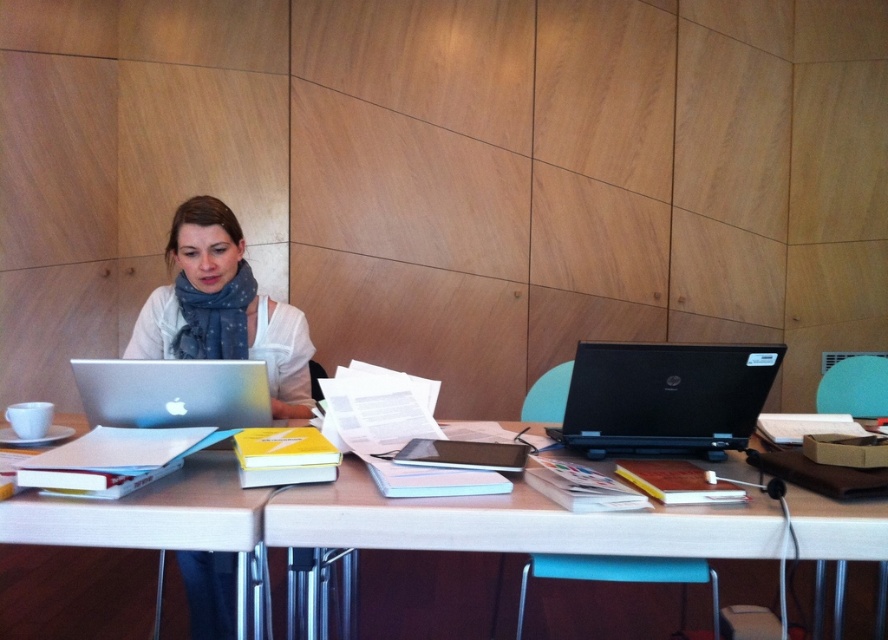
Who is higher up, matte white scarf at upper left or black matte laptop at right?

Positioned higher is matte white scarf at upper left.

Is point (255, 310) positioned in front of point (630, 369)?

No, (255, 310) is further to viewer.

Between point (208, 344) and point (571, 388), which one is positioned in front?

Point (571, 388) is in front.

Identify the location of matte white scarf at upper left. The image size is (888, 640). pos(223,308).

Does white matte table at center appear on the left side of black matte laptop at right?

Indeed, white matte table at center is positioned on the left side of black matte laptop at right.

Is point (670, 506) in front of point (564, 424)?

Yes, it is.

The height and width of the screenshot is (640, 888). Identify the location of white matte table at center. (513, 524).

Between white matte table at center and white glossy table at lower left, which one is positioned higher?

white matte table at center is above.

Which is more to the right, white matte table at center or white glossy table at lower left?

white matte table at center is more to the right.

Is point (486, 534) positioned behind point (179, 522)?

Yes, it is behind point (179, 522).

Identify the location of white matte table at center. This screenshot has width=888, height=640. (513, 524).